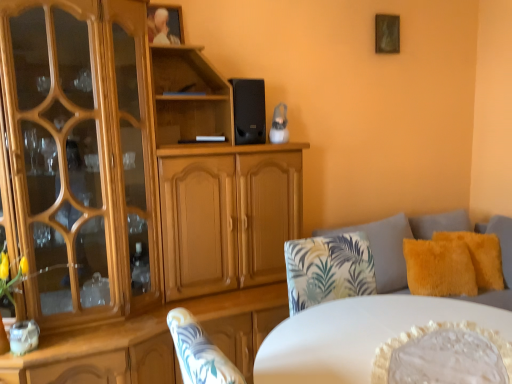
What is the approximate width of fluffy yellow cushions at right?

The width of fluffy yellow cushions at right is 5.24 feet.

The image size is (512, 384). What do you see at coordinates (439, 268) in the screenshot?
I see `fuzzy yellow pillow at right, marked as the 2th pillow in a right-to-left arrangement` at bounding box center [439, 268].

Find the location of a particular element. This screenshot has height=384, width=512. fluffy yellow pillow at right, which is the second pillow from left to right is located at coordinates (480, 256).

The image size is (512, 384). In order to click on black matte speaker at upper center in this screenshot , I will do `click(249, 111)`.

Describe the element at coordinates (357, 335) in the screenshot. The image size is (512, 384). I see `white glossy table at center` at that location.

In order to click on fluffy yellow cushions at right in this screenshot , I will do `click(398, 242)`.

From the image's perspective, relative to white glossy table at center, is wooden picture frame at upper center, the second picture frame positioned from the back, above or below?

wooden picture frame at upper center, the second picture frame positioned from the back, is above white glossy table at center.

Considering the relative sizes of wooden picture frame at upper center, which is counted as the second picture frame, starting from the right, and white glossy table at center in the image provided, is wooden picture frame at upper center, which is counted as the second picture frame, starting from the right, taller than white glossy table at center?

Incorrect, the height of wooden picture frame at upper center, which is counted as the second picture frame, starting from the right, is not larger of that of white glossy table at center.

From the picture: Which of these two, wooden picture frame at upper center, the 1th picture frame in the front-to-back sequence, or white glossy table at center, is bigger?

white glossy table at center is bigger.

Which is farther, [430,262] or [483,287]?

The point [483,287] is more distant.

Looking at this image, is fuzzy yellow pillow at right, marked as the 2th pillow in a right-to-left arrangement, next to fluffy yellow pillow at right, which is the second pillow from left to right?

No.

Could you measure the distance between fuzzy yellow pillow at right, which is counted as the first pillow, starting from the left, and fluffy yellow pillow at right, which ranks as the first pillow in right-to-left order?

They are 6.34 inches apart.

Is fluffy yellow pillow at right, which ranks as the first pillow in right-to-left order, outside of fluffy yellow cushions at right?

No, fluffy yellow pillow at right, which ranks as the first pillow in right-to-left order, is inside fluffy yellow cushions at right's boundary.

Can you confirm if fluffy yellow pillow at right, which ranks as the first pillow in right-to-left order, is wider than fluffy yellow cushions at right?

No, fluffy yellow pillow at right, which ranks as the first pillow in right-to-left order, is not wider than fluffy yellow cushions at right.

Are fluffy yellow pillow at right, which ranks as the first pillow in right-to-left order, and fluffy yellow cushions at right making contact?

Result: No, fluffy yellow pillow at right, which ranks as the first pillow in right-to-left order, is not touching fluffy yellow cushions at right.

Who is smaller, light brown wood cabinet at center or wooden picture frame at upper right, the 1th picture frame from the back?

Smaller between the two is wooden picture frame at upper right, the 1th picture frame from the back.

Is light brown wood cabinet at center thinner than wooden picture frame at upper right, the 1th picture frame from the back?

No, light brown wood cabinet at center is not thinner than wooden picture frame at upper right, the 1th picture frame from the back.

From the image's perspective, does light brown wood cabinet at center appear lower than wooden picture frame at upper right, which ranks as the 2th picture frame in front-to-back order?

Yes, from the image's perspective, light brown wood cabinet at center is beneath wooden picture frame at upper right, which ranks as the 2th picture frame in front-to-back order.

How different are the orientations of light brown wood cabinet at center and wooden picture frame at upper right, which ranks as the 2th picture frame in front-to-back order, in degrees?

The facing directions of light brown wood cabinet at center and wooden picture frame at upper right, which ranks as the 2th picture frame in front-to-back order, are 0.00759 degrees apart.

Based on the photo, is fluffy yellow pillow at right, which is the second pillow from left to right, directly adjacent to black matte speaker at upper center?

No, fluffy yellow pillow at right, which is the second pillow from left to right, is not touching black matte speaker at upper center.

Is point (481, 285) positioned before point (240, 94)?

That is False.

From the picture: From a real-world perspective, who is located lower, fluffy yellow pillow at right, which is the second pillow from left to right, or black matte speaker at upper center?

fluffy yellow pillow at right, which is the second pillow from left to right.

The width and height of the screenshot is (512, 384). What are the coordinates of `the 1st pillow located beneath the black matte speaker at upper center (from a real-world perspective)` in the screenshot? It's located at (480, 256).

Is white glossy table at center not within wooden picture frame at upper right, which ranks as the 2th picture frame in front-to-back order?

white glossy table at center is positioned outside wooden picture frame at upper right, which ranks as the 2th picture frame in front-to-back order.

Is white glossy table at center oriented away from wooden picture frame at upper right, which ranks as the 2th picture frame in front-to-back order?

No, wooden picture frame at upper right, which ranks as the 2th picture frame in front-to-back order, is not at the back of white glossy table at center.

Can you confirm if white glossy table at center is thinner than wooden picture frame at upper right, the 1th picture frame from the back?

In fact, white glossy table at center might be wider than wooden picture frame at upper right, the 1th picture frame from the back.

From a real-world perspective, which is physically below, white glossy table at center or wooden picture frame at upper right, which is the 2th picture frame in left-to-right order?

From a 3D spatial view, white glossy table at center is below.

Does black matte speaker at upper center turn towards light brown wood cabinet at center?

Yes, black matte speaker at upper center is turned towards light brown wood cabinet at center.

The image size is (512, 384). What are the coordinates of `cabinetry that is below the black matte speaker at upper center (from the image's perspective)` in the screenshot? It's located at (135, 194).

From a real-world perspective, is black matte speaker at upper center physically below light brown wood cabinet at center?

Incorrect, from a real-world perspective, black matte speaker at upper center is higher than light brown wood cabinet at center.

Which object is thinner, black matte speaker at upper center or light brown wood cabinet at center?

Thinner between the two is black matte speaker at upper center.

This screenshot has height=384, width=512. Find the location of `table on the right of wooden picture frame at upper center, the 1th picture frame in the front-to-back sequence`. table on the right of wooden picture frame at upper center, the 1th picture frame in the front-to-back sequence is located at coordinates (357, 335).

Find the location of a particular element. The width and height of the screenshot is (512, 384). pillow located above the fuzzy yellow pillow at right, marked as the 2th pillow in a right-to-left arrangement (from a real-world perspective) is located at coordinates 480,256.

Looking at the image, which one is located further to wooden picture frame at upper center, the 1th picture frame when ordered from left to right, black matte speaker at upper center or fuzzy yellow pillow at right, marked as the 2th pillow in a right-to-left arrangement?

fuzzy yellow pillow at right, marked as the 2th pillow in a right-to-left arrangement, is positioned further to the anchor wooden picture frame at upper center, the 1th picture frame when ordered from left to right.

Estimate the real-world distances between objects in this image. Which object is closer to light brown wood cabinet at center, wooden picture frame at upper right, the 1th picture frame from the back, or fluffy yellow pillow at right, which is the second pillow from left to right?

fluffy yellow pillow at right, which is the second pillow from left to right, is closer to light brown wood cabinet at center.

Looking at the image, which one is located further to white glossy table at center, fluffy yellow pillow at right, which ranks as the first pillow in right-to-left order, or wooden picture frame at upper right, placed as the first picture frame when sorted from right to left?

wooden picture frame at upper right, placed as the first picture frame when sorted from right to left, is further to white glossy table at center.

When comparing their distances from light brown wood cabinet at center, does fuzzy yellow pillow at right, marked as the 2th pillow in a right-to-left arrangement, or wooden picture frame at upper center, the 1th picture frame in the front-to-back sequence, seem closer?

wooden picture frame at upper center, the 1th picture frame in the front-to-back sequence, is closer to light brown wood cabinet at center.

Looking at the image, which one is located further to fuzzy yellow pillow at right, marked as the 2th pillow in a right-to-left arrangement, fluffy yellow cushions at right or black matte speaker at upper center?

black matte speaker at upper center.

When comparing their distances from light brown wood cabinet at center, does fluffy yellow cushions at right or wooden picture frame at upper center, the second picture frame positioned from the back, seem closer?

wooden picture frame at upper center, the second picture frame positioned from the back.

Which object lies further to the anchor point wooden picture frame at upper center, which is counted as the second picture frame, starting from the right, white glossy table at center or light brown wood cabinet at center?

Among the two, white glossy table at center is located further to wooden picture frame at upper center, which is counted as the second picture frame, starting from the right.

When comparing their distances from white glossy table at center, does fuzzy yellow pillow at right, marked as the 2th pillow in a right-to-left arrangement, or wooden picture frame at upper center, which is counted as the second picture frame, starting from the right, seem closer?

fuzzy yellow pillow at right, marked as the 2th pillow in a right-to-left arrangement.

Locate an element on the screen. The height and width of the screenshot is (384, 512). pillow between light brown wood cabinet at center and fluffy yellow pillow at right, which is the second pillow from left to right, in the horizontal direction is located at coordinates (439, 268).

Locate an element on the screen. table between wooden picture frame at upper center, the 1th picture frame in the front-to-back sequence, and fluffy yellow pillow at right, which is the second pillow from left to right is located at coordinates (357, 335).

Locate an element on the screen. cabinetry between wooden picture frame at upper center, which is counted as the second picture frame, starting from the right, and white glossy table at center, in the vertical direction is located at coordinates (135, 194).

In order to click on cabinetry between white glossy table at center and wooden picture frame at upper right, placed as the first picture frame when sorted from right to left, along the z-axis in this screenshot , I will do `click(135, 194)`.